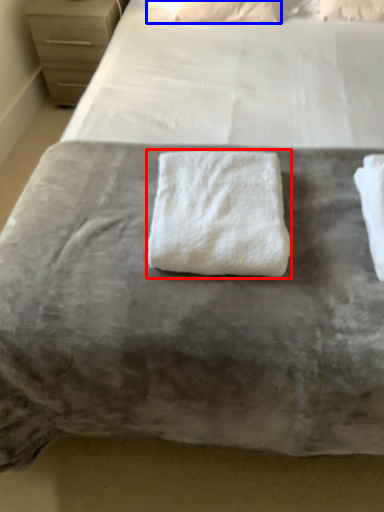
Question: Which object appears closest to the camera in this image, towel (highlighted by a red box) or pillow (highlighted by a blue box)?

Choices:
 (A) towel
 (B) pillow

Answer: (A)